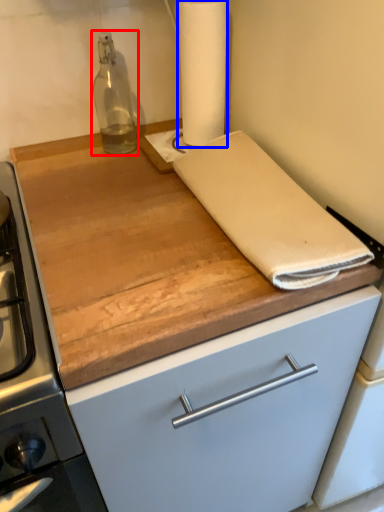
Question: Among these objects, which one is nearest to the camera, bottle (highlighted by a red box) or paper towel (highlighted by a blue box)?

Choices:
 (A) bottle
 (B) paper towel

Answer: (B)